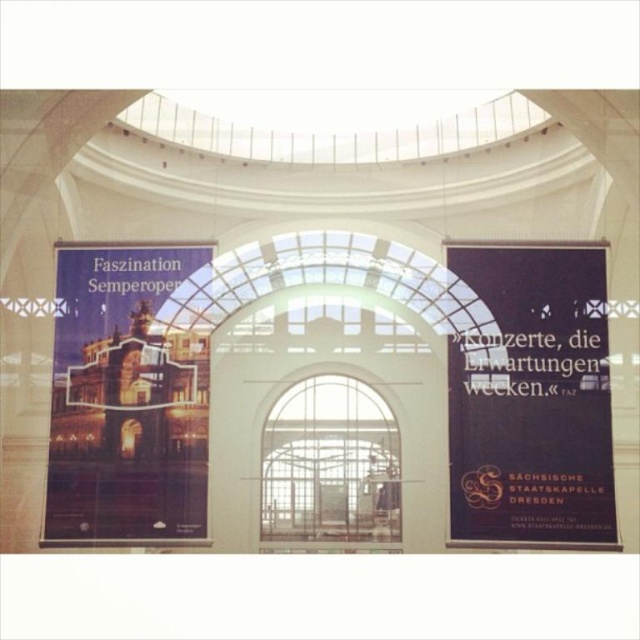
What do you see at coordinates (125, 397) in the screenshot? I see `matte paper poster at left` at bounding box center [125, 397].

Does point (154, 506) come farther from viewer compared to point (385, 509)?

No, it is in front of (385, 509).

Describe the element at coordinates (125, 397) in the screenshot. This screenshot has width=640, height=640. I see `matte paper poster at left` at that location.

You are a GUI agent. You are given a task and a screenshot of the screen. Output one action in this format:
    pyautogui.click(x=<x>, y=<y>)
    Task: Click on the matte paper poster at left
    
    Given the screenshot: What is the action you would take?
    pyautogui.click(x=125, y=397)

Identify the location of black paper poster at right. (532, 400).

Measure the distance between black paper poster at right and camera.

The distance of black paper poster at right from camera is 210.38 feet.

Between point (602, 504) and point (282, 481), which one is positioned in front?

Point (602, 504) is in front.

Where is `black paper poster at right`? This screenshot has height=640, width=640. black paper poster at right is located at coordinates (532, 400).

Between black paper poster at right and matte paper poster at left, which one is positioned lower?

black paper poster at right is lower down.

Is black paper poster at right below matte paper poster at left?

Yes, black paper poster at right is below matte paper poster at left.

Is point (477, 529) less distant than point (196, 406)?

Yes, it is in front of point (196, 406).

The image size is (640, 640). I want to click on black paper poster at right, so click(532, 400).